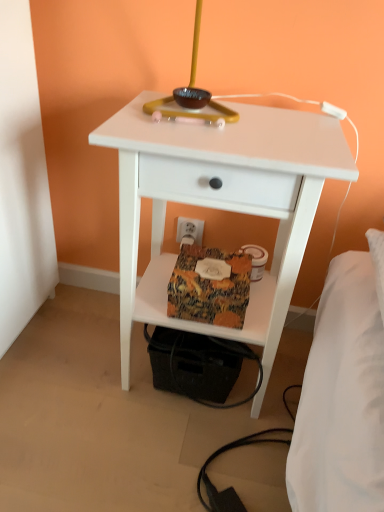
Locate an element on the screen. The height and width of the screenshot is (512, 384). free space to the left of white matte nightstand at center is located at coordinates (67, 362).